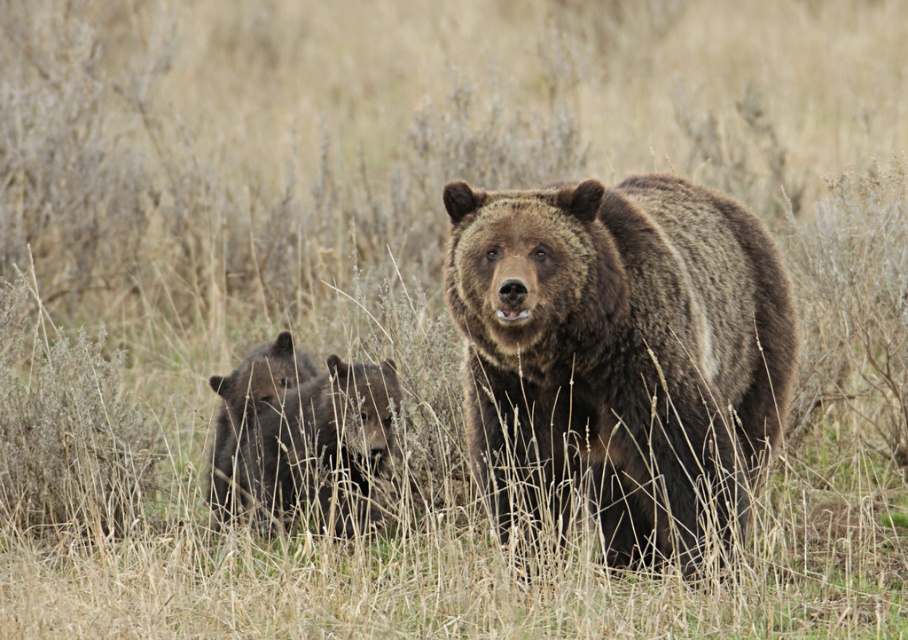
Can you confirm if brown furry bear at center is positioned above shiny black bear at lower left?

Yes, brown furry bear at center is above shiny black bear at lower left.

Does brown furry bear at center appear under shiny black bear at lower left?

No, brown furry bear at center is not below shiny black bear at lower left.

Which is behind, point (521, 248) or point (234, 508)?

The point (234, 508) is more distant.

The width and height of the screenshot is (908, 640). In order to click on brown furry bear at center in this screenshot , I will do `click(619, 353)`.